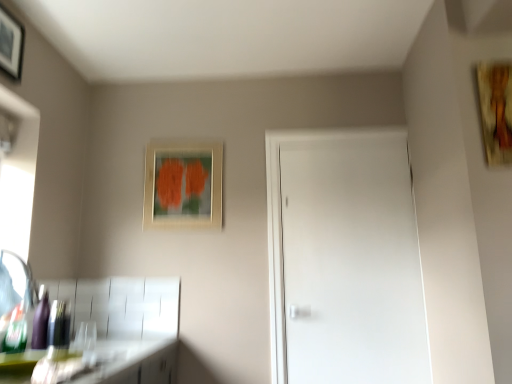
Question: Choose the correct answer: Is green matte countertop at lower left inside white matte door at center or outside it?

Choices:
 (A) inside
 (B) outside

Answer: (B)

Question: From the image's perspective, is green matte countertop at lower left located above or below white matte door at center?

Choices:
 (A) above
 (B) below

Answer: (B)

Question: Which is nearer to the wooden textured painting at upper right, the first picture frame when ordered from front to back?

Choices:
 (A) brushed metal faucet at lower left
 (B) matte wooden picture frame at upper center, which appears as the second picture frame when viewed from the right
 (C) white matte door at center
 (D) wooden picture frame at upper left, the 2th picture frame from the front
 (E) shiny purple bottle at lower left

Answer: (C)

Question: Considering the real-world distances, which object is farthest from the white matte door at center?

Choices:
 (A) green matte countertop at lower left
 (B) shiny purple bottle at lower left
 (C) brushed metal faucet at lower left
 (D) wooden textured painting at upper right, the first picture frame when ordered from front to back
 (E) matte wooden picture frame at upper center, which ranks as the 2th picture frame in left-to-right order

Answer: (C)